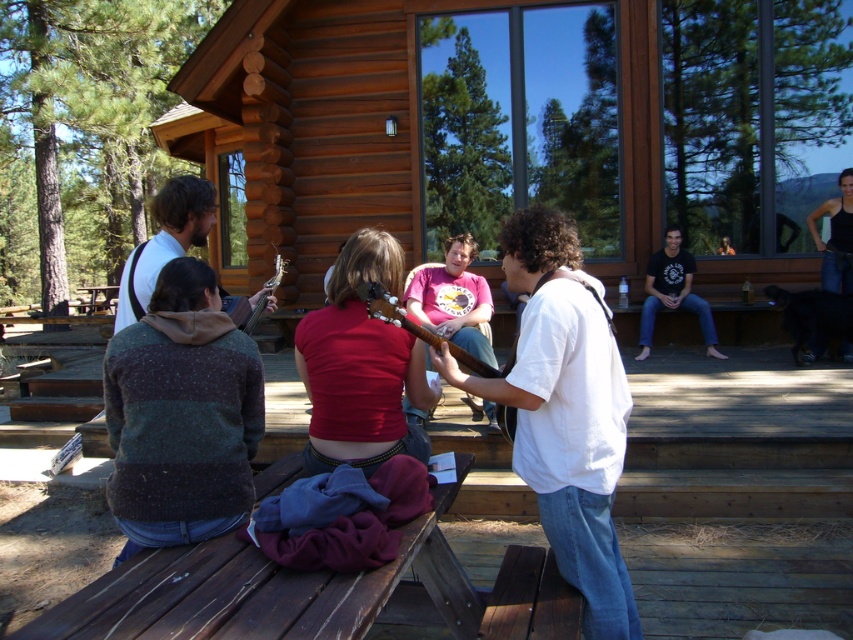
Does white cotton shirt at center have a lesser width compared to wooden acoustic guitar at center?

In fact, white cotton shirt at center might be wider than wooden acoustic guitar at center.

Can you confirm if white cotton shirt at center is shorter than wooden acoustic guitar at center?

In fact, white cotton shirt at center may be taller than wooden acoustic guitar at center.

This screenshot has height=640, width=853. What do you see at coordinates (566, 410) in the screenshot?
I see `white cotton shirt at center` at bounding box center [566, 410].

You are a GUI agent. You are given a task and a screenshot of the screen. Output one action in this format:
    pyautogui.click(x=<x>, y=<y>)
    Task: Click on the white cotton shirt at center
    The image size is (853, 640).
    Given the screenshot: What is the action you would take?
    pyautogui.click(x=566, y=410)

Does point (671, 147) lie in front of point (730, 250)?

Yes.

From the picture: Does wooden cabin at center appear on the left side of white t-shirt at center?

Indeed, wooden cabin at center is positioned on the left side of white t-shirt at center.

Is point (770, 12) farther from viewer compared to point (734, 253)?

No, it is not.

This screenshot has height=640, width=853. I want to click on wooden cabin at center, so click(521, 131).

Which of these two, black cotton shirt at center or matte brown guitar at center, stands taller?

With more height is black cotton shirt at center.

Between point (680, 230) and point (250, 314), which one is positioned in front?

Point (250, 314) is in front.

Image resolution: width=853 pixels, height=640 pixels. What are the coordinates of `black cotton shirt at center` in the screenshot? It's located at (672, 292).